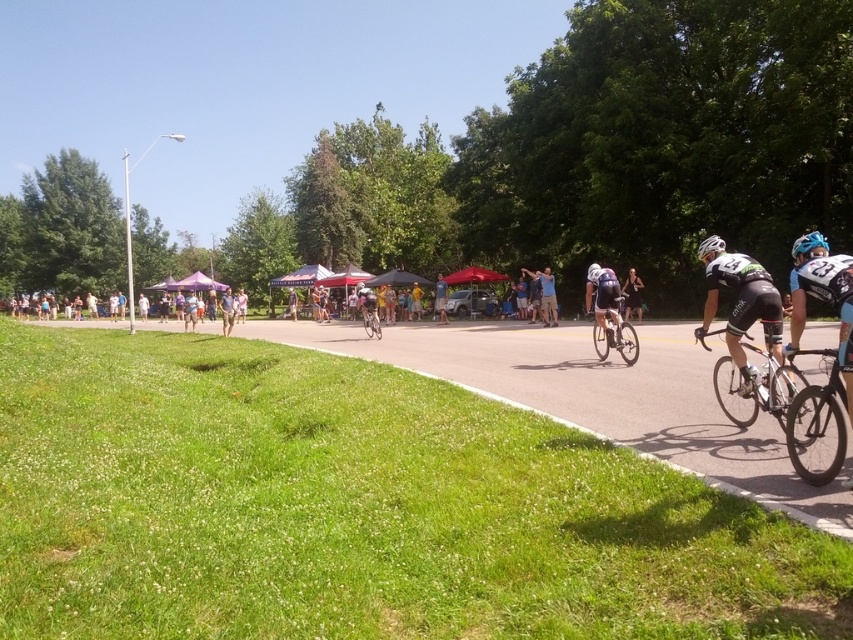
You are a photographer positioned at the center of the image. You want to take a photo that includes both the shiny black bike at lower right and the dark purple dress at center. Given that your camera has a maximum angle of view of 60 degrees, can you capture both subjects in a single frame without moving? Explain your reasoning.

The shiny black bike at lower right and dark purple dress at center are 19.25 meters apart. To determine if they can fit within a 60 degree angle, we calculate the distance between them and compare to the field of view. Assuming the photographer is at the center, the distance from the photographer to each subject would be half of 19.25 meters, which is 9.625 meters. Using trigonometry, the angle between them would be 2 times the arctangent of half the distance divided by the distance to the subject. However

You are a participant in the cycling event and need to decide where to place your bike. The green grass at lower left and blue fabric at center are both options. Which location is wider and thus safer for placing your bike?

The green grass at lower left might be wider than blue fabric at center, so it is safer to place your bike there.